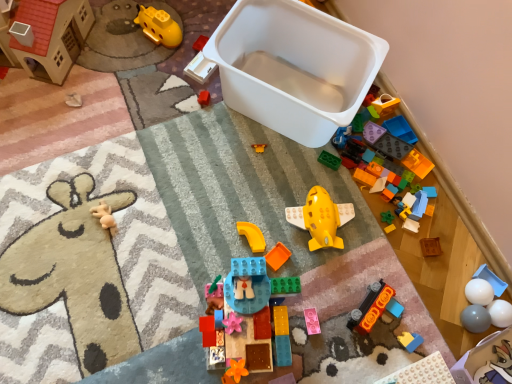
The height and width of the screenshot is (384, 512). In order to click on vacant area that lies between yellow plastic submarine at upper left, which ranks as the fourteenth toy in right-to-left order, and cardboard house at upper left, which is the sixteenth toy in right-to-left order in this screenshot , I will do `click(114, 49)`.